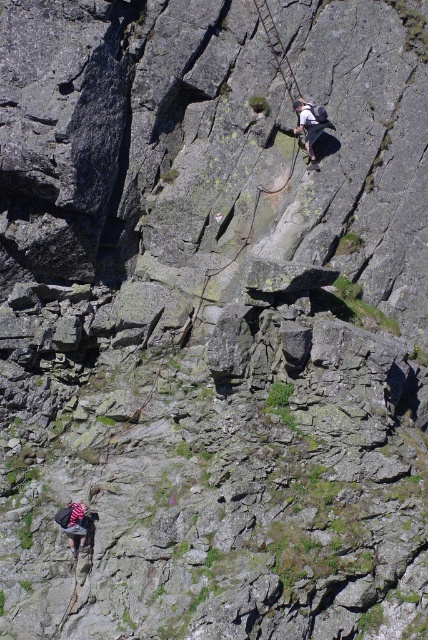
I want to click on matte gray climbing harness at upper center, so click(x=311, y=124).

Locate an element on the screen. The image size is (428, 640). matte gray climbing harness at upper center is located at coordinates (311, 124).